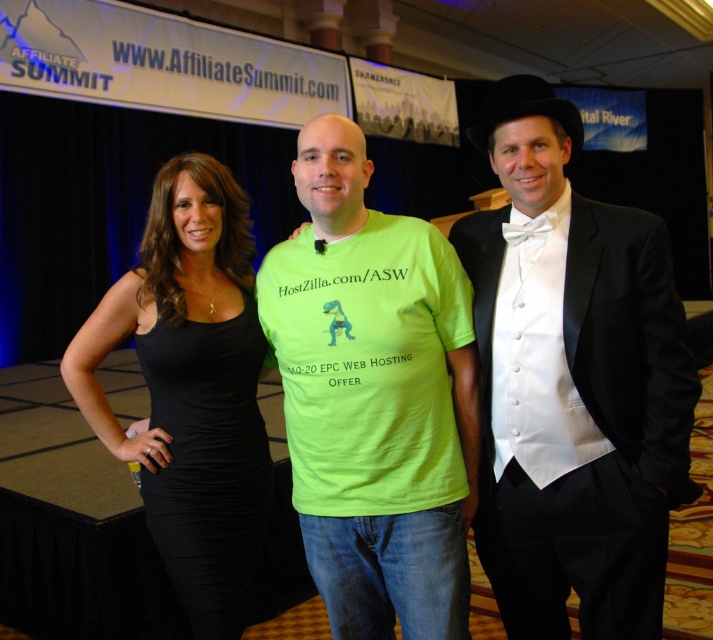
You are at the Affiliate Summit event and want to locate the woman in the black dress at left. What are the coordinates where you should look?

The black dress at left is located at coordinates point (190, 388).

From the picture: Based on the scene description, what is the significance of the point marked at coordinates (374,397)?

The point marked at coordinates (374,397) indicates the location of the neon green t shirt at center.